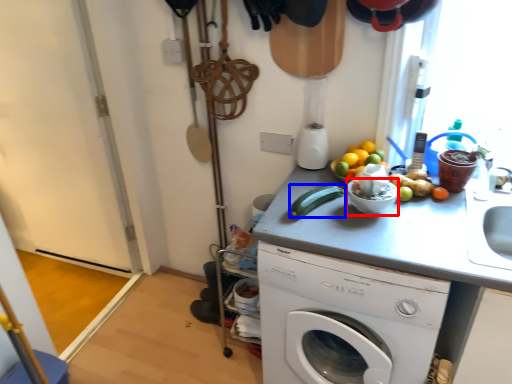
Question: Among these objects, which one is nearest to the camera, basin (highlighted by a red box) or cucumber (highlighted by a blue box)?

Choices:
 (A) basin
 (B) cucumber

Answer: (A)